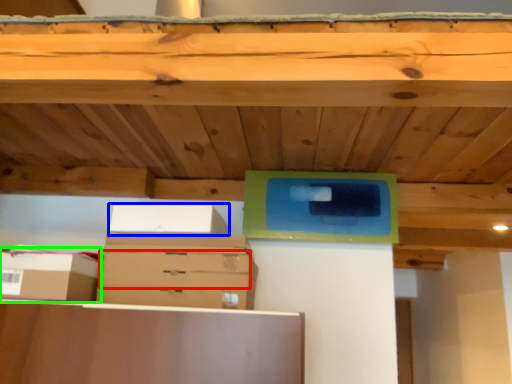
Question: Based on their relative distances, which object is farther from drawer (highlighted by a red box)? Choose from storage box (highlighted by a blue box) and storage box (highlighted by a green box).

Choices:
 (A) storage box
 (B) storage box

Answer: (B)